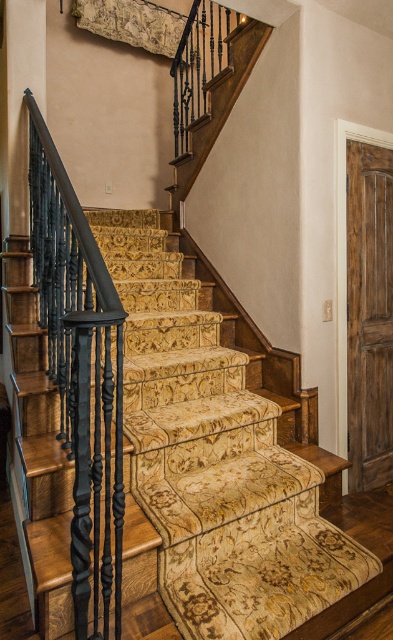
Question: Which of these objects is positioned farthest from the carpeted stairs at center?

Choices:
 (A) black wrought iron railing at left
 (B) rustic wood door at right

Answer: (B)

Question: Is carpeted stairs at center to the right of rustic wood door at right from the viewer's perspective?

Choices:
 (A) yes
 (B) no

Answer: (B)

Question: Can you confirm if carpeted stairs at center is positioned below rustic wood door at right?

Choices:
 (A) yes
 (B) no

Answer: (A)

Question: Considering the relative positions of carpeted stairs at center and black wrought iron railing at left in the image provided, where is carpeted stairs at center located with respect to black wrought iron railing at left?

Choices:
 (A) above
 (B) below

Answer: (B)

Question: Which point is farther to the camera?

Choices:
 (A) black wrought iron railing at left
 (B) carpeted stairs at center
 (C) rustic wood door at right

Answer: (C)

Question: Which point appears closest to the camera in this image?

Choices:
 (A) (165, 324)
 (B) (77, 385)

Answer: (B)